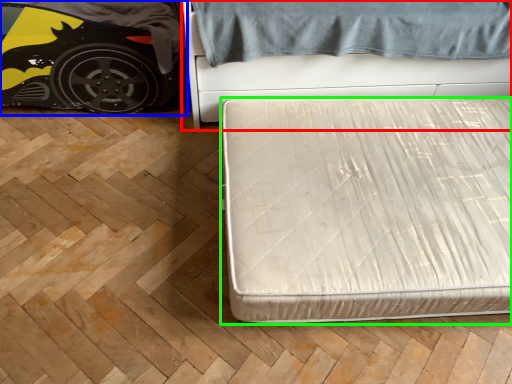
Question: Which is nearer to the bed (highlighted by a red box)? car (highlighted by a blue box) or bed (highlighted by a green box).

Choices:
 (A) car
 (B) bed

Answer: (B)